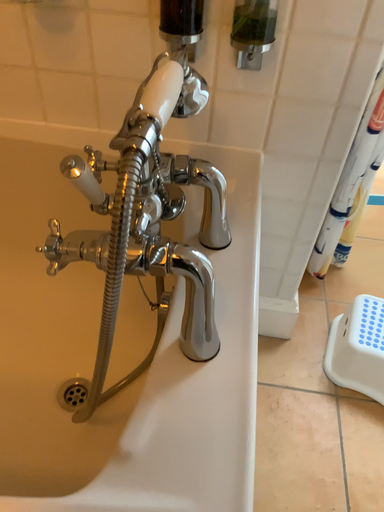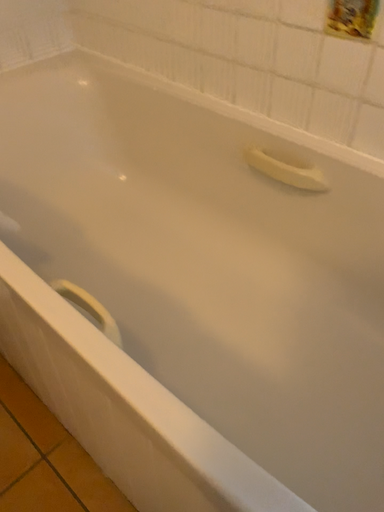
Question: Which way did the camera rotate in the video?

Choices:
 (A) rotated downward
 (B) rotated upward

Answer: (B)